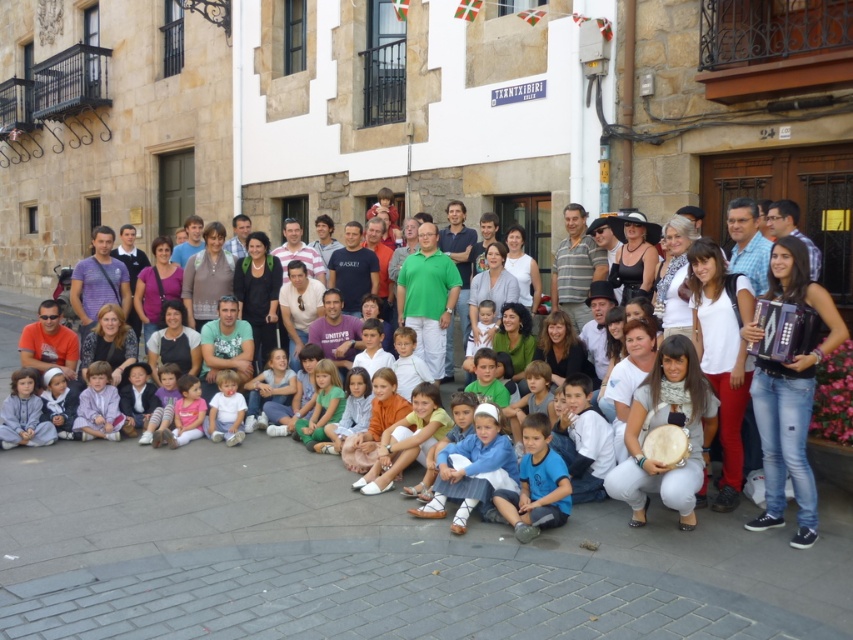
You are a photographer taking a picture of the group. You need to ensure that the purple matte accordion at right and the green cotton dress at center are both visible in the frame. Which object should be placed closer to the left side of the camera frame to achieve this?

→ The green cotton dress at center should be placed closer to the left side of the camera frame because the purple matte accordion at right is positioned on the right side of it. This arrangement will keep both objects within the frame with the green cotton dress at center on the left and the purple matte accordion at right on the right.

You are a photographer trying to arrange the group for a photo. You want to ensure the white cotton shirt at center and the light blue fabric shirt at lower left are visible. Which shirt should you position closer to the center of the frame to make sure both are visible?

The white cotton shirt at center is already positioned on the right side of the light blue fabric shirt at lower left. To ensure both are visible, position the white cotton shirt at center closer to the center of the frame since it is already on the right side of the light blue fabric shirt at lower left.

You are standing in the town square in front of the TXANTXIBIRI building. There is a white cotton shirt at center located at point (193, 502). If you want to find this shirt, which direction should you look relative to the building?

The white cotton shirt at center is located at point (193, 502), which is at the center of the image. Therefore, you should look straight ahead towards the center area in front of the TXANTXIBIRI building to find it.